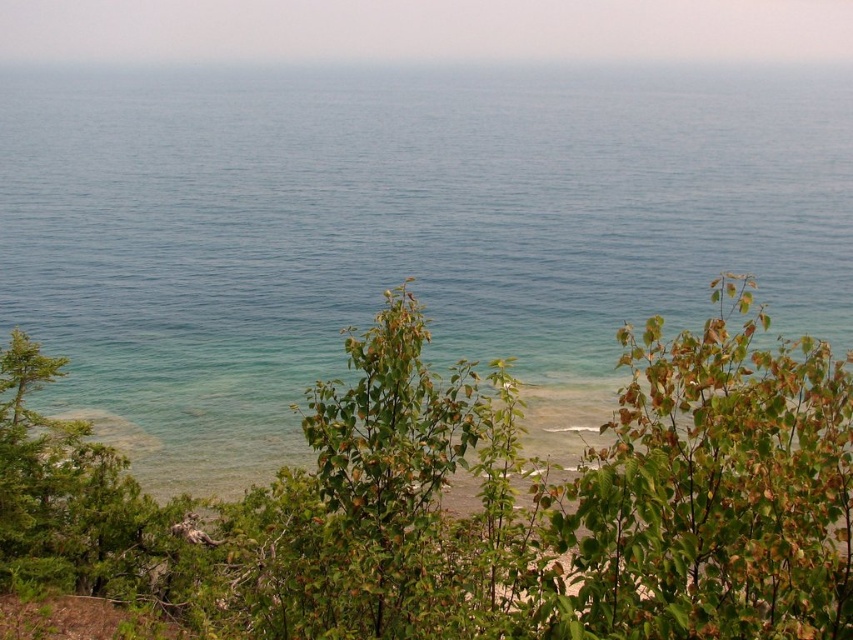
You are standing in the coastal scene and want to walk from the green leafy tree at center to the green leafy shrub at center. Which direction should you face to walk directly towards the shrub?

You should face to the right to walk directly towards the green leafy shrub at center because the green leafy tree at center is to the left of the green leafy shrub at center.

You are a gardener who needs to place a 2.5 meter long fence between the green leafy tree at center and the green leafy shrub at center. Will the fence fit between them?

The distance between the green leafy tree at center and the green leafy shrub at center is 2.31 meters. Since the fence is 2.5 meters long, it will not fit between them as the distance is shorter than the fence length.

You are standing at the edge of the green leafy tree at center and want to reach the clear blue water at center. Which direction should you move to get there?

The clear blue water at center is to the right of the green leafy tree at center, so you should move to the right to reach it.